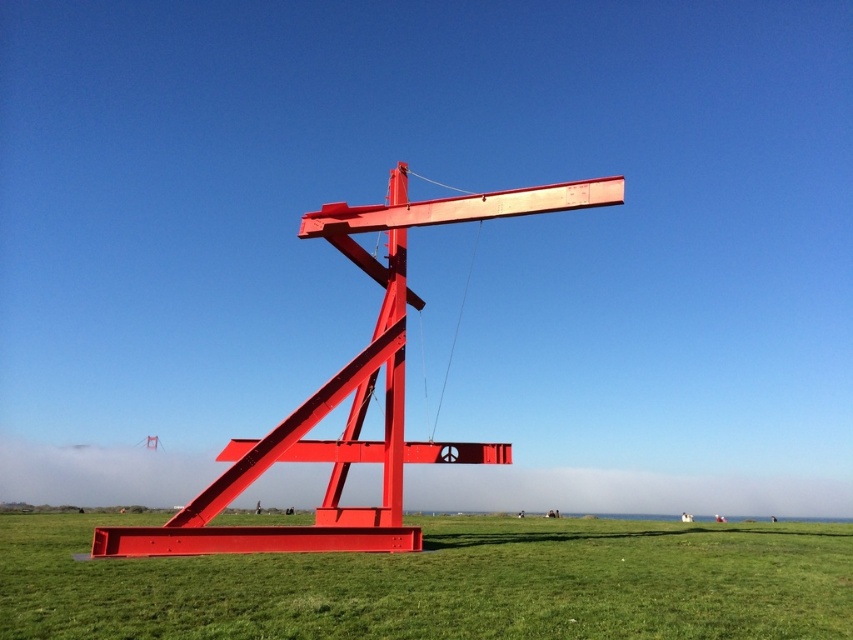
You are a gardener who needs to mow the green grass at center before the art exhibition starts in an hour. Considering the height of the grass and the sculpture, will you be able to mow the grass without damaging the metallic red sculpture at center?

The green grass at center is much taller than the metallic red sculpture at center. Since the grass is taller, it is likely that the sculpture is lower to the ground, so mowing the grass should be possible without damaging the metallic red sculpture at center.

You are standing at the base of the red metal sculpture in the grassy field. You notice a point marked at coordinates [444,584]. What is located at that point?

The point at coordinates [444,584] has green grass at center.

You are a photographer planning to capture the entire metallic red sculpture at center and the green grass at center in one frame. Based on the scene, which object occupies more horizontal space in the image?

The green grass at center is wider than the metallic red sculpture at center, so it occupies more horizontal space in the image.